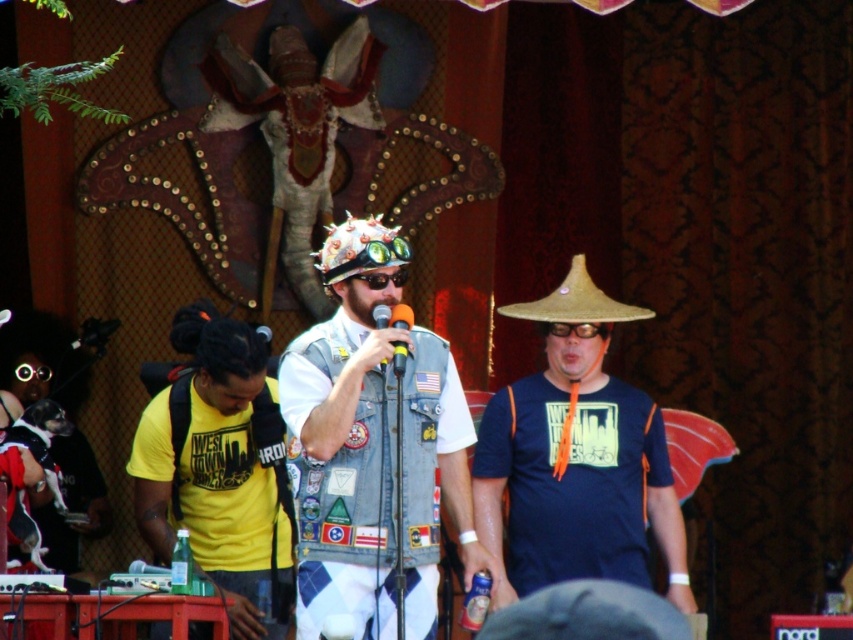
You are standing at the origin point in the image coordinate system. The denim vest at center is located at point 0.756, 0.400. Can you walk directly towards it without any obstacles?

Yes, you can walk directly towards the denim vest at center located at point (x=340, y=483) since there are no obstacles mentioned in the scene description.